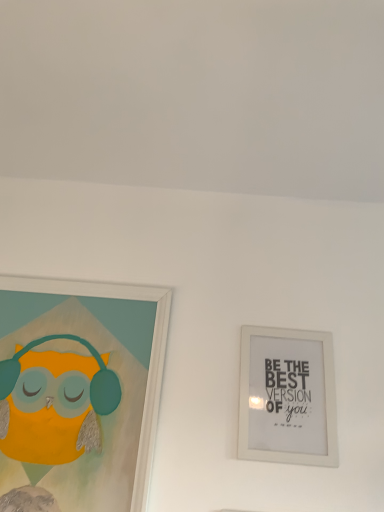
Question: Should I look upward or downward to see matte white picture frame at left, marked as the 1th picture frame in a left-to-right arrangement?

Choices:
 (A) up
 (B) down

Answer: (B)

Question: Is matte white picture frame at left, marked as the 1th picture frame in a left-to-right arrangement, outside of white matte picture frame at upper right, which is counted as the first picture frame, starting from the right?

Choices:
 (A) no
 (B) yes

Answer: (B)

Question: Can you confirm if matte white picture frame at left, marked as the 1th picture frame in a left-to-right arrangement, is shorter than white matte picture frame at upper right, which is counted as the first picture frame, starting from the right?

Choices:
 (A) no
 (B) yes

Answer: (A)

Question: From a real-world perspective, does matte white picture frame at left, marked as the 1th picture frame in a left-to-right arrangement, stand above white matte picture frame at upper right, positioned as the 2th picture frame in left-to-right order?

Choices:
 (A) no
 (B) yes

Answer: (A)

Question: Can you confirm if matte white picture frame at left, marked as the 1th picture frame in a left-to-right arrangement, is taller than white matte picture frame at upper right, positioned as the 2th picture frame in left-to-right order?

Choices:
 (A) no
 (B) yes

Answer: (B)

Question: Is matte white picture frame at left, marked as the second picture frame in a right-to-left arrangement, far from white matte picture frame at upper right, positioned as the 2th picture frame in left-to-right order?

Choices:
 (A) no
 (B) yes

Answer: (A)

Question: From the image's perspective, is matte white picture frame at left, marked as the 1th picture frame in a left-to-right arrangement, located beneath white matte picture frame at upper right, which is counted as the first picture frame, starting from the right?

Choices:
 (A) yes
 (B) no

Answer: (B)

Question: Is white matte picture frame at upper right, which is counted as the first picture frame, starting from the right, outside matte white picture frame at left, marked as the second picture frame in a right-to-left arrangement?

Choices:
 (A) no
 (B) yes

Answer: (B)

Question: Can you confirm if white matte picture frame at upper right, which is counted as the first picture frame, starting from the right, is wider than matte white picture frame at left, marked as the second picture frame in a right-to-left arrangement?

Choices:
 (A) yes
 (B) no

Answer: (B)

Question: Does white matte picture frame at upper right, positioned as the 2th picture frame in left-to-right order, come behind matte white picture frame at left, marked as the 1th picture frame in a left-to-right arrangement?

Choices:
 (A) yes
 (B) no

Answer: (A)

Question: From a real-world perspective, is white matte picture frame at upper right, which is counted as the first picture frame, starting from the right, below matte white picture frame at left, marked as the second picture frame in a right-to-left arrangement?

Choices:
 (A) no
 (B) yes

Answer: (A)

Question: Is white matte picture frame at upper right, positioned as the 2th picture frame in left-to-right order, positioned before matte white picture frame at left, marked as the 1th picture frame in a left-to-right arrangement?

Choices:
 (A) no
 (B) yes

Answer: (A)

Question: Is white matte picture frame at upper right, positioned as the 2th picture frame in left-to-right order, thinner than matte white picture frame at left, marked as the 1th picture frame in a left-to-right arrangement?

Choices:
 (A) yes
 (B) no

Answer: (A)

Question: In the image, is matte white picture frame at left, marked as the second picture frame in a right-to-left arrangement, positioned in front of or behind white matte picture frame at upper right, positioned as the 2th picture frame in left-to-right order?

Choices:
 (A) front
 (B) behind

Answer: (A)